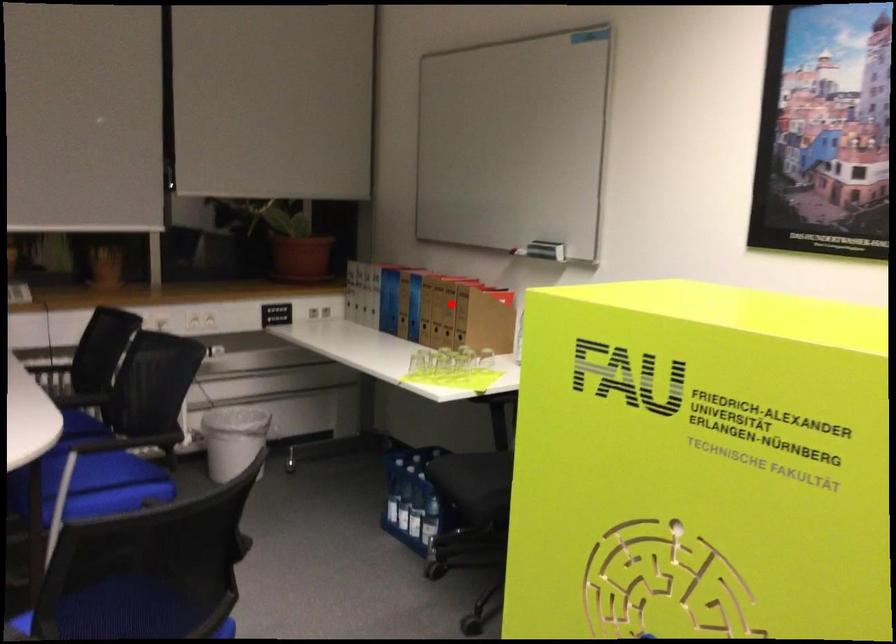
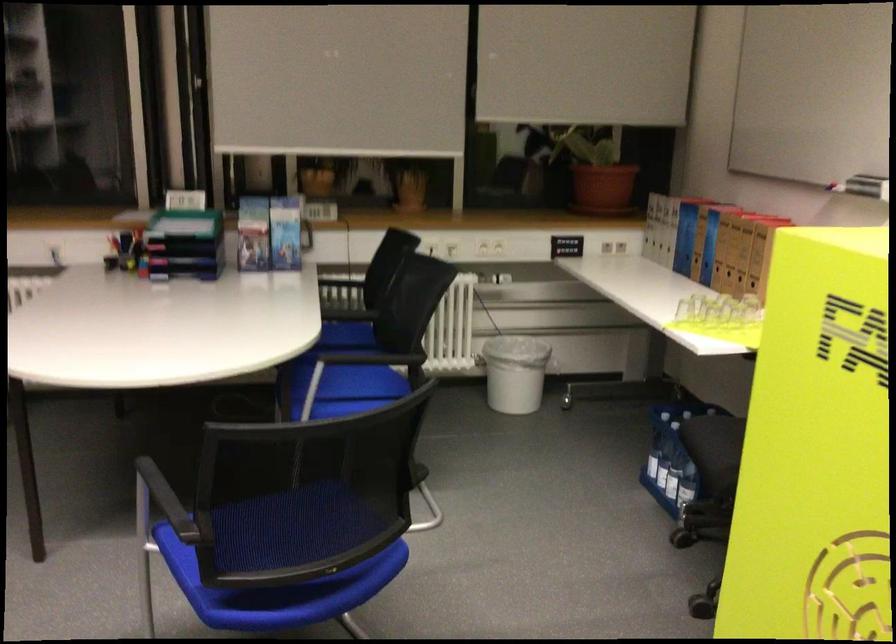
Question: I am providing you with two images of the same scene from different viewpoints. A red point is shown in image1. For the corresponding object point in image2, is it positioned nearer or farther from the camera?

Choices:
 (A) Nearer
 (B) Farther

Answer: (A)